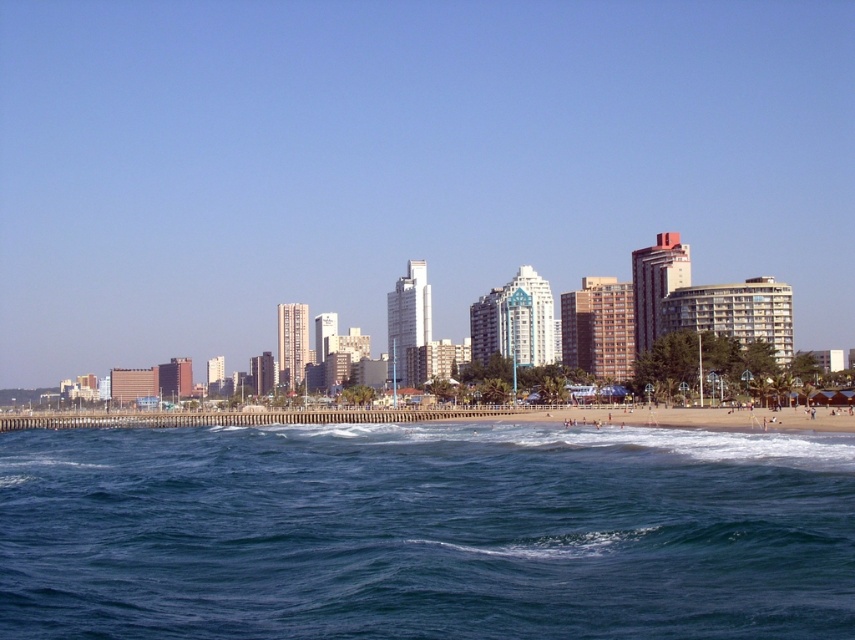
Question: Considering the relative positions of blue water at lower center and smooth sand beach at lower center in the image provided, where is blue water at lower center located with respect to smooth sand beach at lower center?

Choices:
 (A) above
 (B) below

Answer: (A)

Question: Which point appears farthest from the camera in this image?

Choices:
 (A) click(370, 586)
 (B) click(675, 426)

Answer: (B)

Question: Can you confirm if blue water at lower center is bigger than smooth sand beach at lower center?

Choices:
 (A) no
 (B) yes

Answer: (A)

Question: Does blue water at lower center appear under smooth sand beach at lower center?

Choices:
 (A) yes
 (B) no

Answer: (B)

Question: Which of the following is the closest to the observer?

Choices:
 (A) (561, 417)
 (B) (435, 444)

Answer: (B)